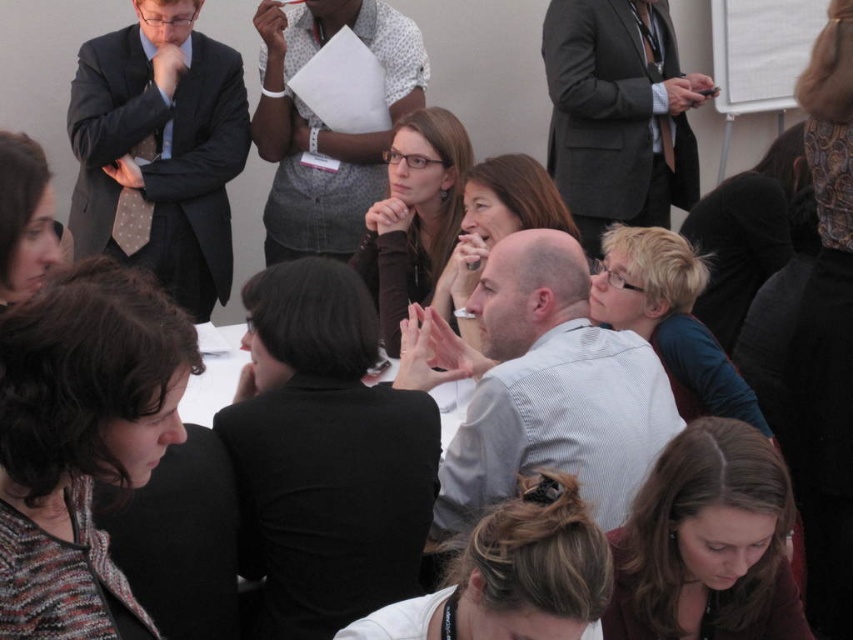
In the conference room scene, there is a person wearing a matte gray shirt at center. Can you tell me the exact coordinates of where this person is located?

The matte gray shirt at center is located at coordinates point [495,227].

Based on the scene description, where is the smooth brown hair at lower center located in the image?

The smooth brown hair at lower center is located at point [706,541].